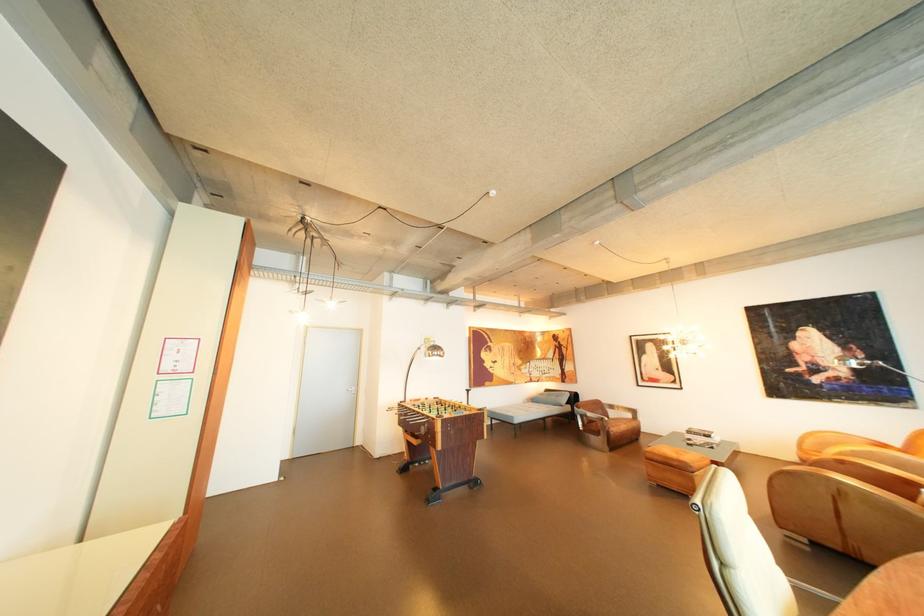
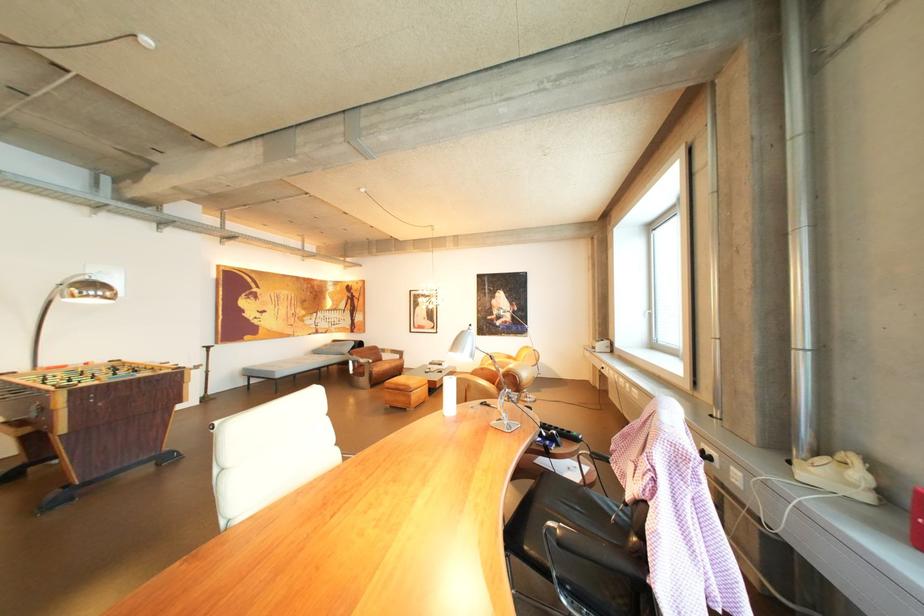
Question: The images are taken continuously from a first-person perspective. In which direction is your viewpoint rotating?

Choices:
 (A) Left
 (B) Right
 (C) Up
 (D) Down

Answer: (B)